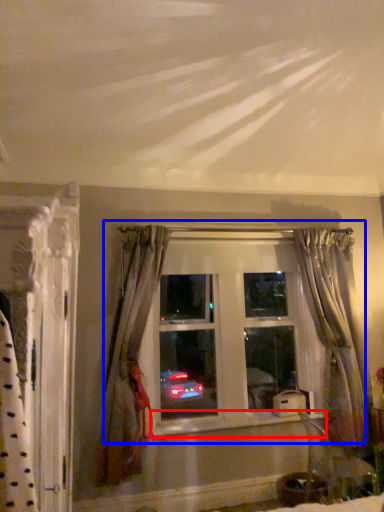
Question: Among these objects, which one is nearest to the camera, window sill (highlighted by a red box) or window (highlighted by a blue box)?

Choices:
 (A) window sill
 (B) window

Answer: (A)